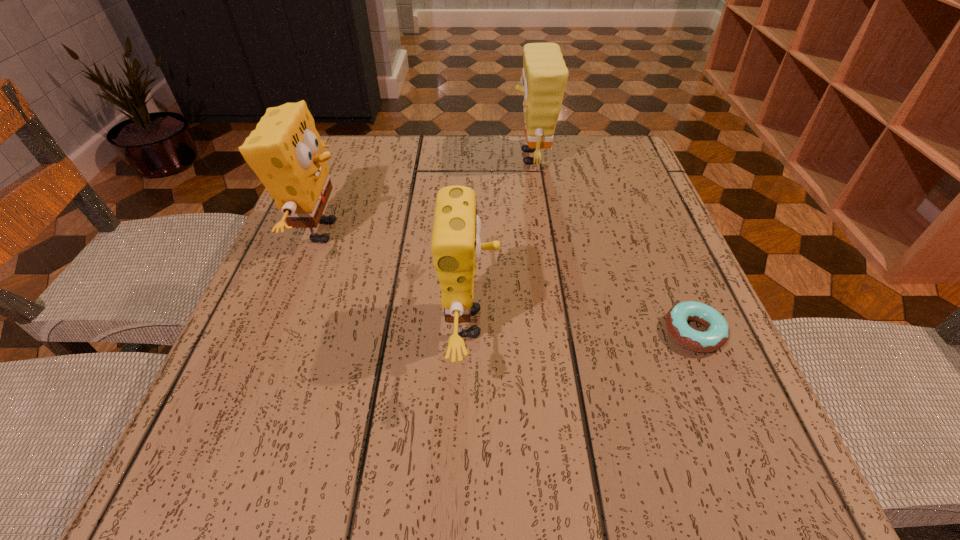
Identify the location of the farthest sponge. (544, 76).

I want to click on the rightmost sponge, so click(x=544, y=76).

At what (x,y) coordinates should I click in order to perform the action: click on the leftmost object. Please return your answer as a coordinate pair (x, y). The image size is (960, 540). Looking at the image, I should click on (285, 152).

Identify the location of the second object from left to right. The height and width of the screenshot is (540, 960). (456, 246).

Identify the location of the rightmost object. (716, 335).

Identify the location of doughnut. (716, 335).

Find the location of a particular element. vacant area situated 0.390m on the face of the farthest sponge is located at coordinates (348, 158).

Where is `vacant space located on the face of the farthest sponge`? The image size is (960, 540). vacant space located on the face of the farthest sponge is located at coordinates (370, 158).

Locate an element on the screen. Image resolution: width=960 pixels, height=540 pixels. free space located on the face of the farthest sponge is located at coordinates (432, 158).

I want to click on vacant region located 0.140m on the face of the leftmost sponge, so click(422, 231).